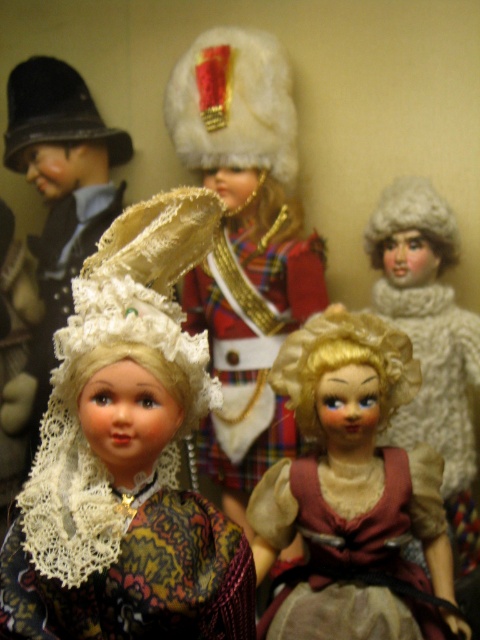
Describe the element at coordinates (351, 492) in the screenshot. I see `matte brown fabric doll at center` at that location.

The width and height of the screenshot is (480, 640). I want to click on matte brown fabric doll at center, so coord(351,492).

Can you confirm if matte brown fabric doll at center is smaller than white fur hat at center?

Yes, matte brown fabric doll at center is smaller than white fur hat at center.

Is point (340, 563) positioned in front of point (283, 435)?

Yes, it is.

Where is `matte brown fabric doll at center`? This screenshot has width=480, height=640. matte brown fabric doll at center is located at coordinates (351, 492).

Is white fur hat at center shorter than lace fabric dress at lower left?

No.

Is point (212, 445) in front of point (252, 595)?

No, it is not.

Where is `white fur hat at center`? white fur hat at center is located at coordinates (244, 244).